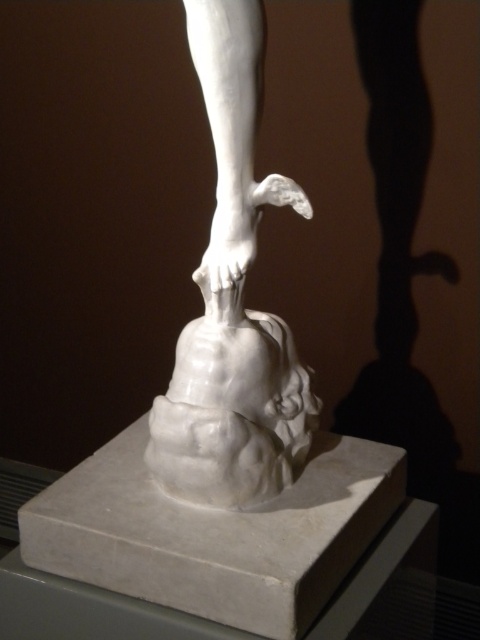
Question: Is white marble sculpture at center closer to camera compared to white marble person at center?

Choices:
 (A) no
 (B) yes

Answer: (B)

Question: From the image, what is the correct spatial relationship of white marble sculpture at center in relation to white marble person at center?

Choices:
 (A) above
 (B) below

Answer: (A)

Question: Is white marble sculpture at center smaller than white marble person at center?

Choices:
 (A) yes
 (B) no

Answer: (B)

Question: Which point appears closest to the camera in this image?

Choices:
 (A) (176, 440)
 (B) (189, 493)

Answer: (A)

Question: Which point is farther to the camera?

Choices:
 (A) (242, 412)
 (B) (230, 465)

Answer: (A)